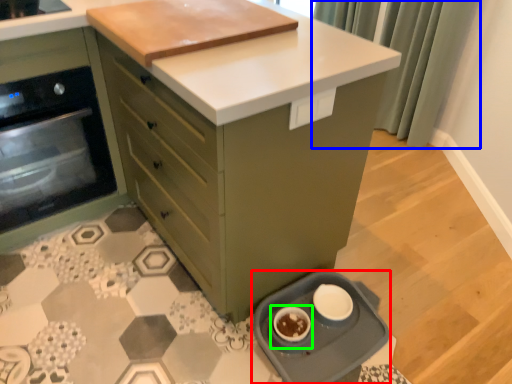
Question: Estimate the real-world distances between objects in this image. Which object is farther from kitchen appliance (highlighted by a red box), curtain (highlighted by a blue box) or appliance (highlighted by a green box)?

Choices:
 (A) curtain
 (B) appliance

Answer: (A)